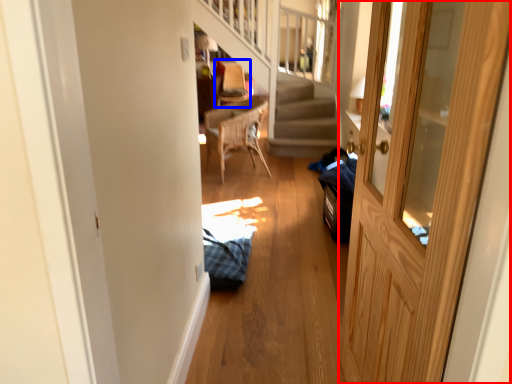
Question: Which object appears farthest to the camera in this image, door (highlighted by a red box) or armchair (highlighted by a blue box)?

Choices:
 (A) door
 (B) armchair

Answer: (B)